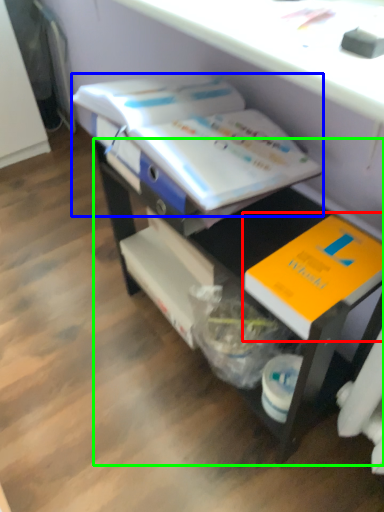
Question: Which is nearer to the book (highlighted by a red box)? book (highlighted by a blue box) or desk (highlighted by a green box).

Choices:
 (A) book
 (B) desk

Answer: (B)